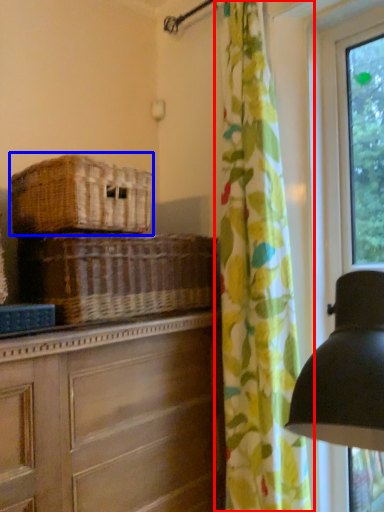
Question: Which object appears farthest to the camera in this image, curtain (highlighted by a red box) or basket (highlighted by a blue box)?

Choices:
 (A) curtain
 (B) basket

Answer: (A)